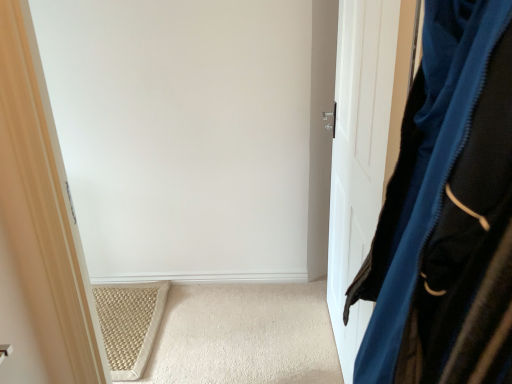
In order to click on white matte door at center in this screenshot , I will do `click(364, 146)`.

This screenshot has width=512, height=384. Describe the element at coordinates (364, 146) in the screenshot. I see `white matte door at center` at that location.

What are the coordinates of `white matte door at center` in the screenshot? It's located at (364, 146).